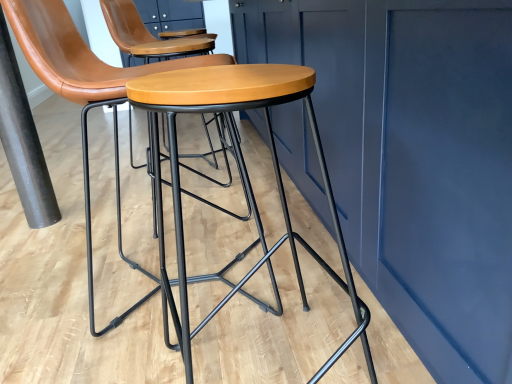
Question: Does wooden/matte stool at center turn towards black matte pole at left?

Choices:
 (A) no
 (B) yes

Answer: (A)

Question: Can you confirm if wooden/matte stool at center is bigger than black matte pole at left?

Choices:
 (A) no
 (B) yes

Answer: (B)

Question: Is black matte pole at left a part of wooden/matte stool at center?

Choices:
 (A) no
 (B) yes

Answer: (A)

Question: Would you say wooden/matte stool at center is outside black matte pole at left?

Choices:
 (A) yes
 (B) no

Answer: (A)

Question: From the image's perspective, is wooden/matte stool at center beneath black matte pole at left?

Choices:
 (A) no
 (B) yes

Answer: (B)

Question: Is wooden/matte stool at center smaller than black matte pole at left?

Choices:
 (A) no
 (B) yes

Answer: (A)

Question: From a real-world perspective, is black matte pole at left physically above wooden/matte stool at center?

Choices:
 (A) yes
 (B) no

Answer: (A)

Question: Can we say black matte pole at left lies outside wooden/matte stool at center?

Choices:
 (A) no
 (B) yes

Answer: (B)

Question: Does black matte pole at left have a smaller size compared to wooden/matte stool at center?

Choices:
 (A) no
 (B) yes

Answer: (B)

Question: From a real-world perspective, is black matte pole at left physically below wooden/matte stool at center?

Choices:
 (A) yes
 (B) no

Answer: (B)

Question: Can you confirm if black matte pole at left is thinner than wooden/matte stool at center?

Choices:
 (A) yes
 (B) no

Answer: (A)

Question: Is black matte pole at left oriented away from wooden/matte stool at center?

Choices:
 (A) yes
 (B) no

Answer: (B)

Question: Can you confirm if wooden/matte stool at center is thinner than matte black stool at center?

Choices:
 (A) yes
 (B) no

Answer: (A)